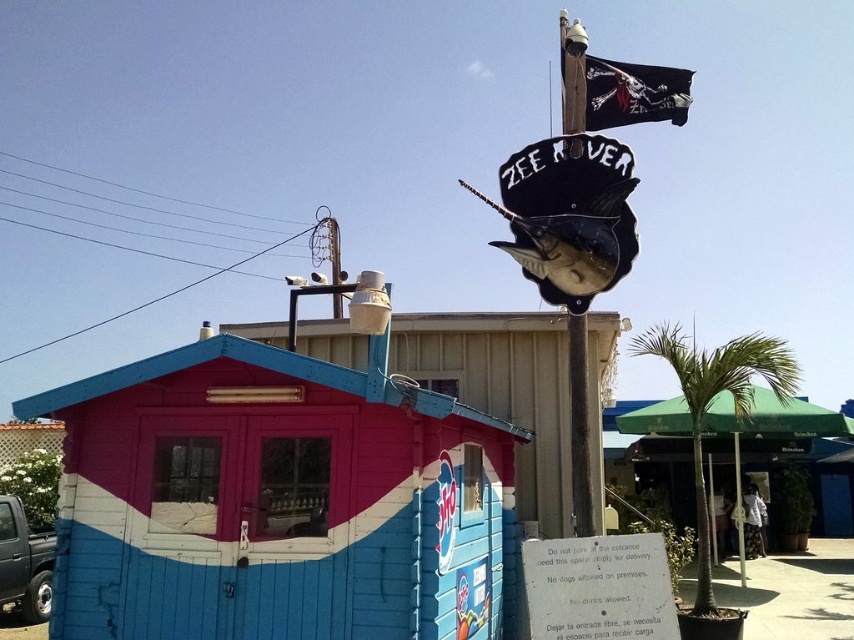
Question: Is blue painted wood beach hut at lower left above green fabric umbrella at right?

Choices:
 (A) no
 (B) yes

Answer: (B)

Question: Observing the image, what is the correct spatial positioning of blue painted wood beach hut at lower left in reference to green fabric umbrella at right?

Choices:
 (A) right
 (B) left

Answer: (B)

Question: Which point is farther to the camera?

Choices:
 (A) (674, 428)
 (B) (60, 492)

Answer: (A)

Question: Is blue painted wood beach hut at lower left behind green fabric umbrella at right?

Choices:
 (A) no
 (B) yes

Answer: (A)

Question: Among these objects, which one is nearest to the camera?

Choices:
 (A) green fabric umbrella at right
 (B) blue painted wood beach hut at lower left

Answer: (B)